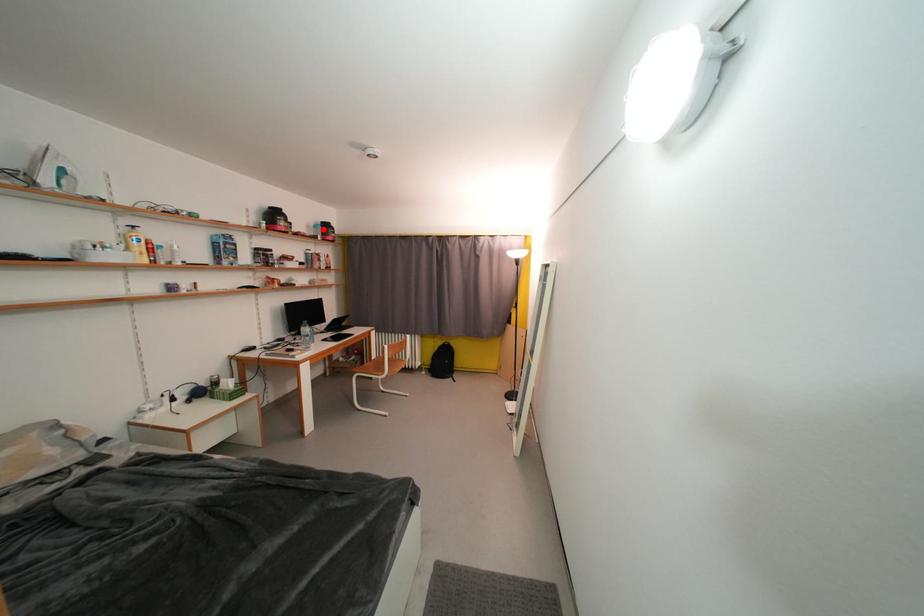
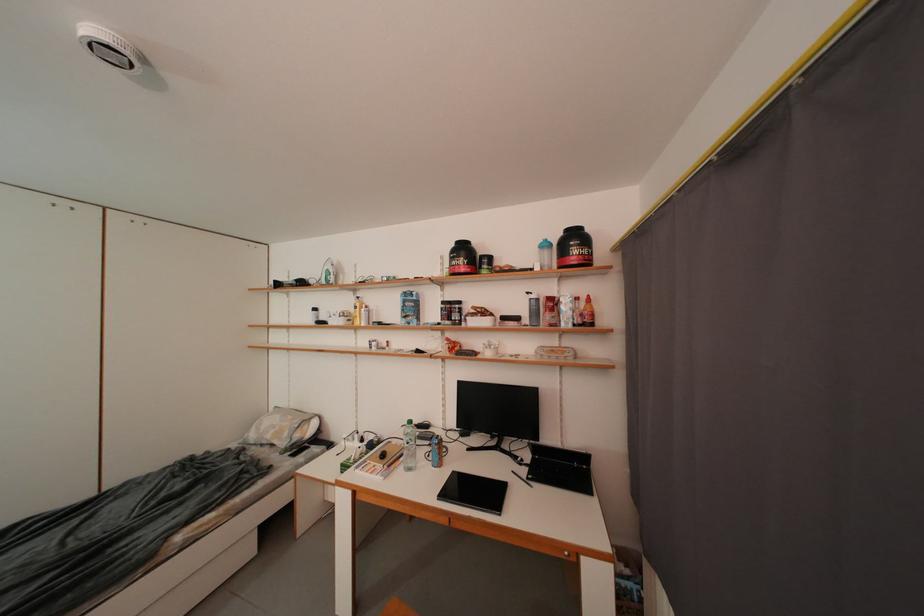
The point at the highlighted location is marked in the first image. Where is the corresponding point in the second image?

(553, 249)